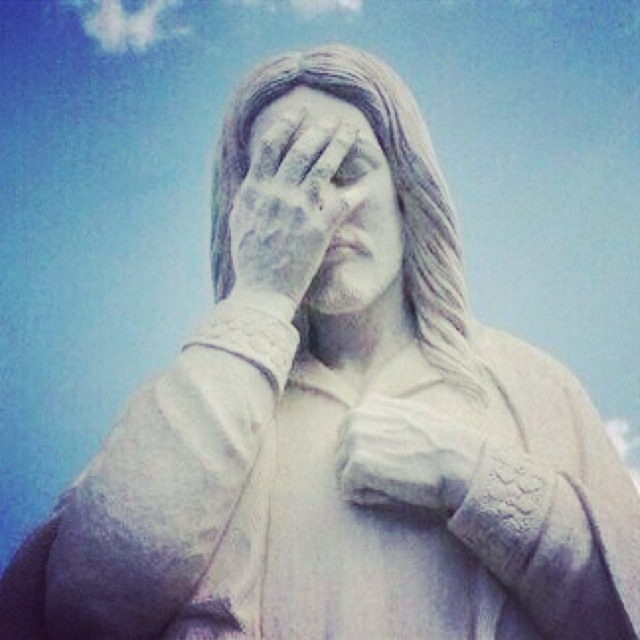
Question: Does white stone hand at center appear under white marble eye at center?

Choices:
 (A) no
 (B) yes

Answer: (B)

Question: Which point is closer to the camera?

Choices:
 (A) (420, 500)
 (B) (356, 160)

Answer: (A)

Question: Does white stone hand at center have a smaller size compared to white marble eye at center?

Choices:
 (A) no
 (B) yes

Answer: (A)

Question: Based on their relative distances, which object is farther from the white stone face at center?

Choices:
 (A) white stone hand at center
 (B) white marble eye at center

Answer: (A)

Question: Which object is farther from the camera taking this photo?

Choices:
 (A) white stone hand at center
 (B) white stone face at center

Answer: (B)

Question: Can you confirm if white stone face at center is bigger than white stone hand at center?

Choices:
 (A) no
 (B) yes

Answer: (B)